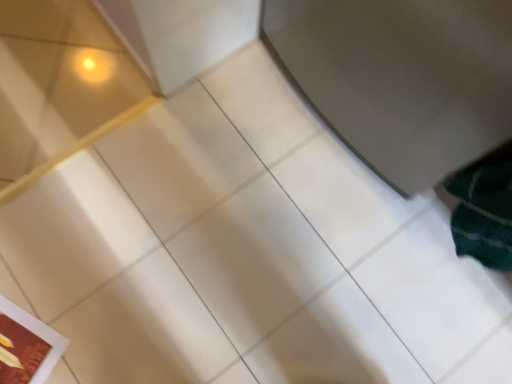
Measure the distance between point (492, 202) and camera.

The distance of point (492, 202) from camera is 28.03 inches.

The image size is (512, 384). What do you see at coordinates (484, 209) in the screenshot? I see `dark green knitted laundry at lower right` at bounding box center [484, 209].

Where is `dark green knitted laundry at lower right`? This screenshot has width=512, height=384. dark green knitted laundry at lower right is located at coordinates (484, 209).

This screenshot has height=384, width=512. In order to click on dark green knitted laundry at lower right in this screenshot , I will do `click(484, 209)`.